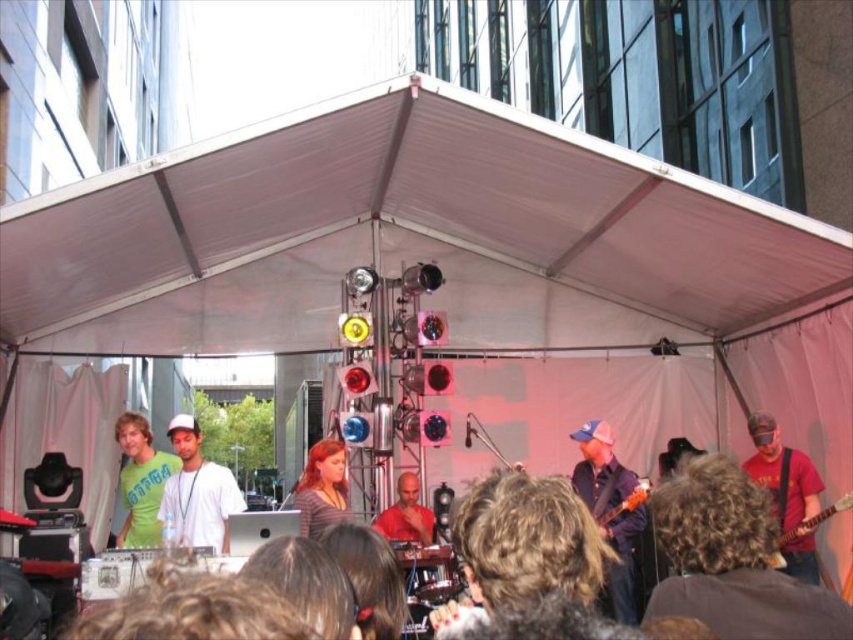
Question: Is green matte t-shirt at left smaller than smooth red shirt at center?

Choices:
 (A) yes
 (B) no

Answer: (B)

Question: Estimate the real-world distances between objects in this image. Which object is closer to the matte gray shirt at center?

Choices:
 (A) curly brown hair at lower right
 (B) curly hair at center
 (C) white matte shirt at center
 (D) matte red guitar at lower right

Answer: (C)

Question: In this image, where is curly brown hair at lower right located relative to blue fabric cap at upper center?

Choices:
 (A) above
 (B) below

Answer: (A)

Question: Which point is farther from the camera taking this photo?

Choices:
 (A) (398, 515)
 (B) (469, 531)
 (C) (596, 474)
 (D) (235, 502)

Answer: (A)

Question: Which point is closer to the camera taking this photo?

Choices:
 (A) (160, 516)
 (B) (154, 490)

Answer: (A)

Question: Does curly hair at center appear over matte gray shirt at center?

Choices:
 (A) no
 (B) yes

Answer: (B)